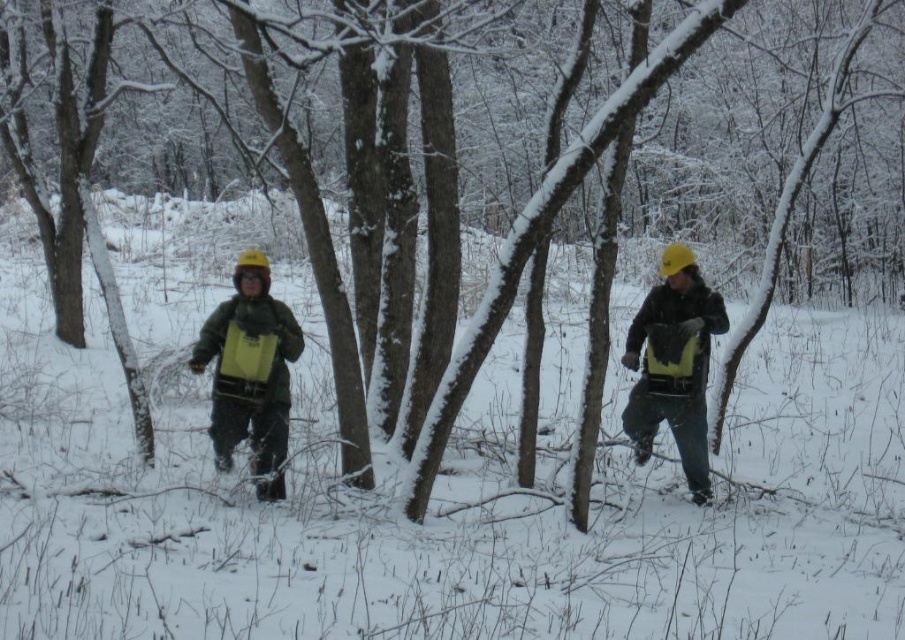
Does matte green jacket at center appear over yellow matte backpack at center?

Yes, matte green jacket at center is above yellow matte backpack at center.

Does matte green jacket at center appear on the left side of yellow matte backpack at center?

Correct, you'll find matte green jacket at center to the left of yellow matte backpack at center.

Locate an element on the screen. The height and width of the screenshot is (640, 905). matte green jacket at center is located at coordinates (250, 372).

This screenshot has width=905, height=640. I want to click on matte green jacket at center, so click(x=250, y=372).